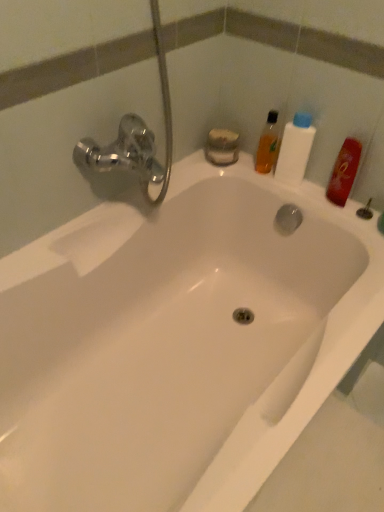
Question: Is white plastic bottle at upper right wider or thinner than red matte bottle at upper right, which appears as the 1th mouthwash when viewed from the right?

Choices:
 (A) thin
 (B) wide

Answer: (B)

Question: Is white plastic bottle at upper right taller or shorter than red matte bottle at upper right, which appears as the 1th mouthwash when viewed from the right?

Choices:
 (A) short
 (B) tall

Answer: (B)

Question: Which is nearer to the red matte bottle at upper right, which appears as the 1th mouthwash when viewed from the right?

Choices:
 (A) translucent orange bottle at upper right, placed as the first mouthwash when sorted from left to right
 (B) white plastic bottle at upper right

Answer: (B)

Question: Considering the real-world distances, which object is closest to the translucent orange bottle at upper right, which is counted as the 2th mouthwash, starting from the right?

Choices:
 (A) white plastic bottle at upper right
 (B) red matte bottle at upper right, which appears as the 1th mouthwash when viewed from the right

Answer: (A)